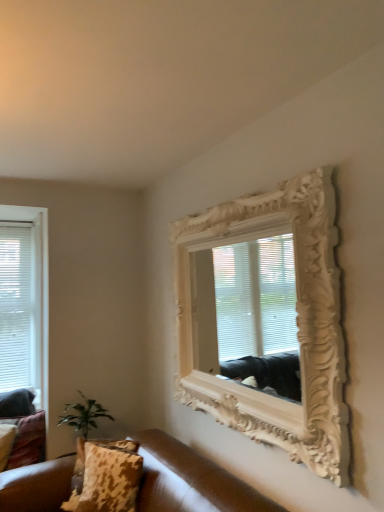
Question: From a real-world perspective, is green leafy plant at lower left physically located above or below leopard print fabric pillow at lower left, the first pillow viewed from the back?

Choices:
 (A) above
 (B) below

Answer: (A)

Question: Considering their positions, is green leafy plant at lower left located in front of or behind leopard print fabric pillow at lower left, the first pillow viewed from the back?

Choices:
 (A) behind
 (B) front

Answer: (B)

Question: Considering the real-world distances, which object is closest to the brown leather couch at lower left?

Choices:
 (A) green leafy plant at lower left
 (B) leopard print fabric pillow at lower left, which appears as the 2th pillow when viewed from the right
 (C) leopard print fabric pillow at lower left, placed as the second pillow when sorted from front to back
 (D) white carved wood mirror at upper right
 (E) leopard print fabric pillow at lower left, positioned as the 1th pillow in right-to-left order

Answer: (E)

Question: Which object is the closest to the leopard print fabric pillow at lower left, marked as the 3th pillow in a front-to-back arrangement?

Choices:
 (A) green leafy plant at lower left
 (B) white carved wood mirror at upper right
 (C) leopard print fabric pillow at lower left, arranged as the third pillow when viewed from the right
 (D) leopard print fabric pillow at lower left, the 3th pillow when ordered from back to front
 (E) brown leather couch at lower left

Answer: (C)